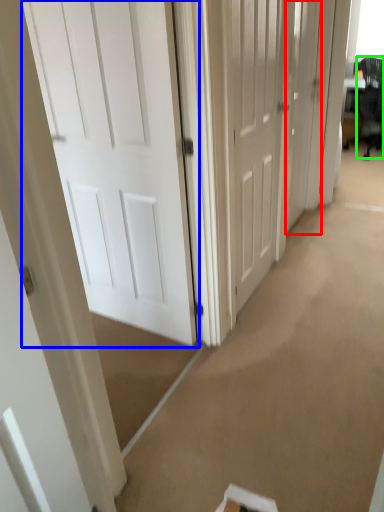
Question: Which object is the closest to the door (highlighted by a red box)? Choose among these: door (highlighted by a blue box) or swivel chair (highlighted by a green box).

Choices:
 (A) door
 (B) swivel chair

Answer: (A)